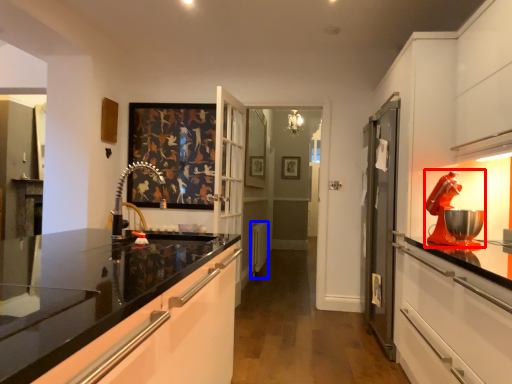
Question: Which of the following is the closest to the observer, home appliance (highlighted by a red box) or appliance (highlighted by a blue box)?

Choices:
 (A) home appliance
 (B) appliance

Answer: (A)